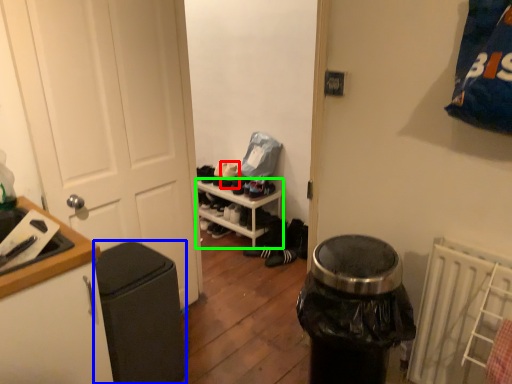
Question: Considering the real-world distances, which object is closest to shoe (highlighted by a red box)? garbage (highlighted by a blue box) or shelf (highlighted by a green box).

Choices:
 (A) garbage
 (B) shelf

Answer: (B)